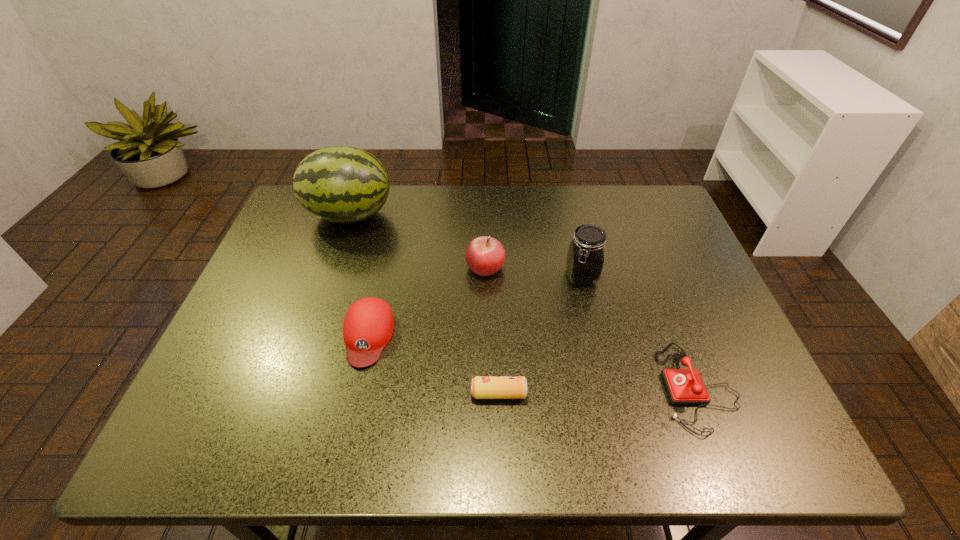
This screenshot has height=540, width=960. In order to click on object that ranks as the second closest to the fourth shortest object in this screenshot , I will do `click(368, 326)`.

This screenshot has width=960, height=540. In order to click on free point that satisfies the following two spatial constraints: 1. at the stem end of the third tallest object; 2. on the left side of the farthest object in this screenshot , I will do `click(332, 267)`.

I want to click on free spot that satisfies the following two spatial constraints: 1. at the stem end of the tallest object; 2. on the right side of the beer can, so click(x=289, y=393).

Locate an element on the screen. The height and width of the screenshot is (540, 960). vacant space that satisfies the following two spatial constraints: 1. at the stem end of the watermelon; 2. on the left side of the apple is located at coordinates (332, 267).